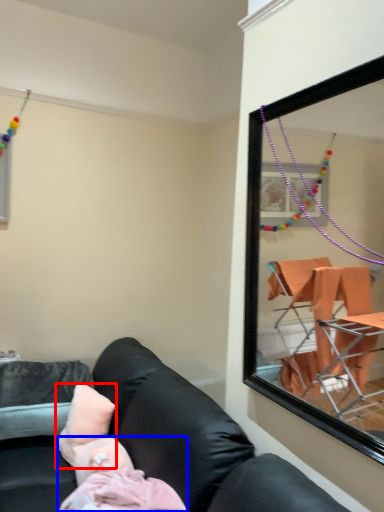
Question: Which object appears farthest to the camera in this image, pillow (highlighted by a red box) or person (highlighted by a blue box)?

Choices:
 (A) pillow
 (B) person

Answer: (A)